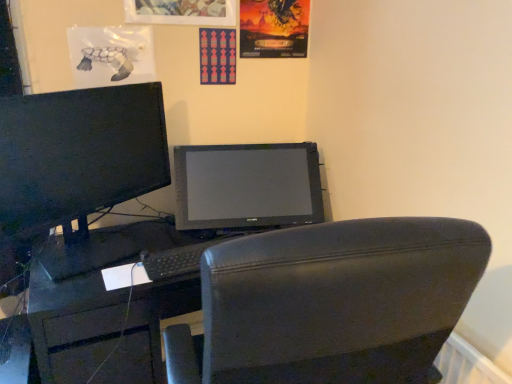
Question: Is matte paper poster at upper center, marked as the 2th poster page in a left-to-right arrangement, wider than black leather chair at center?

Choices:
 (A) yes
 (B) no

Answer: (B)

Question: Would you say matte paper poster at upper center, marked as the 2th poster page in a left-to-right arrangement, contains black leather chair at center?

Choices:
 (A) yes
 (B) no

Answer: (B)

Question: Is matte paper poster at upper center, which appears as the first poster page when viewed from the right, outside black leather chair at center?

Choices:
 (A) no
 (B) yes

Answer: (B)

Question: From the image's perspective, is matte paper poster at upper center, which appears as the first poster page when viewed from the right, located beneath black leather chair at center?

Choices:
 (A) no
 (B) yes

Answer: (A)

Question: Is matte paper poster at upper center, marked as the 2th poster page in a left-to-right arrangement, taller than black leather chair at center?

Choices:
 (A) yes
 (B) no

Answer: (B)

Question: Is matte paper poster at upper center, marked as the 2th poster page in a left-to-right arrangement, shorter than black leather chair at center?

Choices:
 (A) no
 (B) yes

Answer: (B)

Question: Is the position of black leather chair at center less distant than that of matte black monitor at left?

Choices:
 (A) yes
 (B) no

Answer: (A)

Question: Is black leather chair at center located outside matte black monitor at left?

Choices:
 (A) no
 (B) yes

Answer: (B)

Question: Is the position of black leather chair at center more distant than that of matte black monitor at left?

Choices:
 (A) yes
 (B) no

Answer: (B)

Question: Is black leather chair at center oriented towards matte black monitor at left?

Choices:
 (A) no
 (B) yes

Answer: (A)

Question: Is black leather chair at center not near matte black monitor at left?

Choices:
 (A) no
 (B) yes

Answer: (A)

Question: Is black leather chair at center taller than matte black monitor at left?

Choices:
 (A) yes
 (B) no

Answer: (A)

Question: Is black matte keyboard at center not inside black leather chair at center?

Choices:
 (A) no
 (B) yes

Answer: (B)